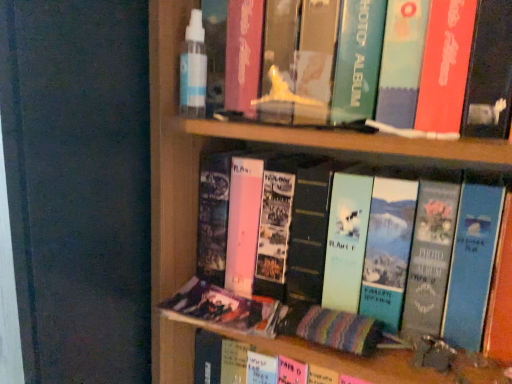
Question: Does matte plastic photo album at lower center, which ranks as the 1th book in bottom-to-top order, have a greater width compared to matte green photo album at center, placed as the first book when sorted from top to bottom?

Choices:
 (A) yes
 (B) no

Answer: (B)

Question: Is matte plastic photo album at lower center, which ranks as the 1th book in bottom-to-top order, aimed at matte green photo album at center, placed as the first book when sorted from top to bottom?

Choices:
 (A) no
 (B) yes

Answer: (A)

Question: Considering the relative sizes of matte plastic photo album at lower center, which ranks as the 1th book in bottom-to-top order, and matte green photo album at center, the 2th book ordered from the bottom, in the image provided, is matte plastic photo album at lower center, which ranks as the 1th book in bottom-to-top order, thinner than matte green photo album at center, the 2th book ordered from the bottom,?

Choices:
 (A) no
 (B) yes

Answer: (B)

Question: Considering the relative sizes of matte plastic photo album at lower center, which ranks as the 1th book in bottom-to-top order, and matte green photo album at center, the 2th book ordered from the bottom, in the image provided, is matte plastic photo album at lower center, which ranks as the 1th book in bottom-to-top order, shorter than matte green photo album at center, the 2th book ordered from the bottom,?

Choices:
 (A) yes
 (B) no

Answer: (A)

Question: Are matte plastic photo album at lower center, the second book from the top, and matte green photo album at center, placed as the first book when sorted from top to bottom, far apart?

Choices:
 (A) yes
 (B) no

Answer: (B)

Question: Does matte plastic photo album at lower center, the second book from the top, come in front of matte green photo album at center, the 2th book ordered from the bottom?

Choices:
 (A) yes
 (B) no

Answer: (B)

Question: Does matte green photo album at center, placed as the first book when sorted from top to bottom, turn towards matte plastic photo album at lower center, which ranks as the 1th book in bottom-to-top order?

Choices:
 (A) yes
 (B) no

Answer: (A)

Question: Can you confirm if matte green photo album at center, placed as the first book when sorted from top to bottom, is positioned to the left of matte plastic photo album at lower center, the second book from the top?

Choices:
 (A) no
 (B) yes

Answer: (A)

Question: Considering the relative sizes of matte green photo album at center, placed as the first book when sorted from top to bottom, and matte plastic photo album at lower center, the second book from the top, in the image provided, is matte green photo album at center, placed as the first book when sorted from top to bottom, shorter than matte plastic photo album at lower center, the second book from the top,?

Choices:
 (A) no
 (B) yes

Answer: (A)

Question: Is matte green photo album at center, the 2th book ordered from the bottom, positioned in front of matte plastic photo album at lower center, which ranks as the 1th book in bottom-to-top order?

Choices:
 (A) yes
 (B) no

Answer: (A)

Question: Can you confirm if matte green photo album at center, the 2th book ordered from the bottom, is smaller than matte plastic photo album at lower center, the second book from the top?

Choices:
 (A) yes
 (B) no

Answer: (B)

Question: Considering the relative sizes of matte green photo album at center, the 2th book ordered from the bottom, and matte plastic photo album at lower center, the second book from the top, in the image provided, is matte green photo album at center, the 2th book ordered from the bottom, thinner than matte plastic photo album at lower center, the second book from the top,?

Choices:
 (A) yes
 (B) no

Answer: (B)

Question: From a real-world perspective, relative to matte plastic photo album at lower center, the second book from the top, is matte green photo album at center, the 2th book ordered from the bottom, vertically above or below?

Choices:
 (A) below
 (B) above

Answer: (B)